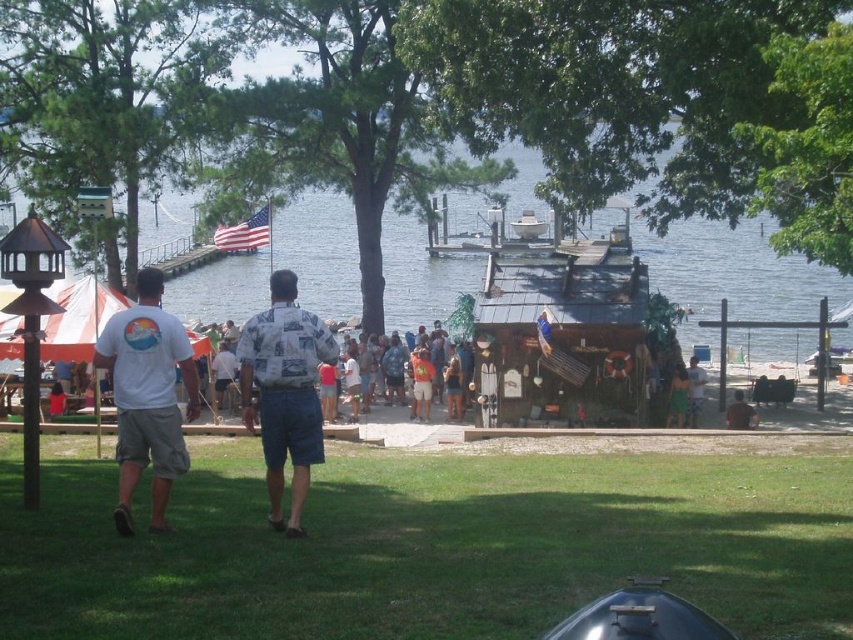
How distant is green grass at lower center from brown leather chair at lower right?

They are 44.29 feet apart.

Which is behind, point (801, 604) or point (750, 419)?

The point (750, 419) is more distant.

Who is more forward, (397, 513) or (738, 406)?

Positioned in front is point (397, 513).

I want to click on green grass at lower center, so click(428, 545).

Can you confirm if metallic silver grill at lower center is wider than camouflage shirt at center?

Indeed, metallic silver grill at lower center has a greater width compared to camouflage shirt at center.

Does metallic silver grill at lower center appear on the left side of camouflage shirt at center?

Incorrect, metallic silver grill at lower center is not on the left side of camouflage shirt at center.

Measure the distance between metallic silver grill at lower center and camera.

A distance of 17.75 feet exists between metallic silver grill at lower center and camera.

Locate an element on the screen. This screenshot has width=853, height=640. metallic silver grill at lower center is located at coordinates (639, 616).

Who is more forward, (399, 371) or (753, 417)?

Positioned in front is point (753, 417).

Measure the distance between camouflage shirt at center and brown leather chair at lower right.

camouflage shirt at center and brown leather chair at lower right are 6.95 meters apart.

Is point (419, 406) positioned before point (733, 404)?

No, it is behind (733, 404).

Find the location of `camouflage shirt at center`. camouflage shirt at center is located at coordinates [x=432, y=378].